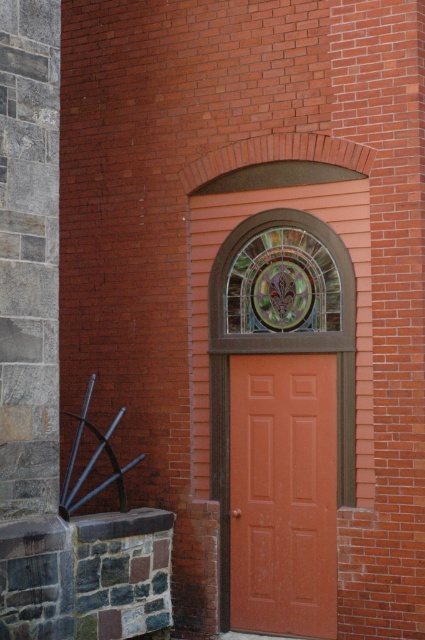
Can you confirm if matte orange door at center is positioned to the right of stained glass window at center?

Incorrect, matte orange door at center is not on the right side of stained glass window at center.

Describe the element at coordinates (283, 493) in the screenshot. I see `matte orange door at center` at that location.

Image resolution: width=425 pixels, height=640 pixels. In order to click on matte orange door at center in this screenshot , I will do `click(283, 493)`.